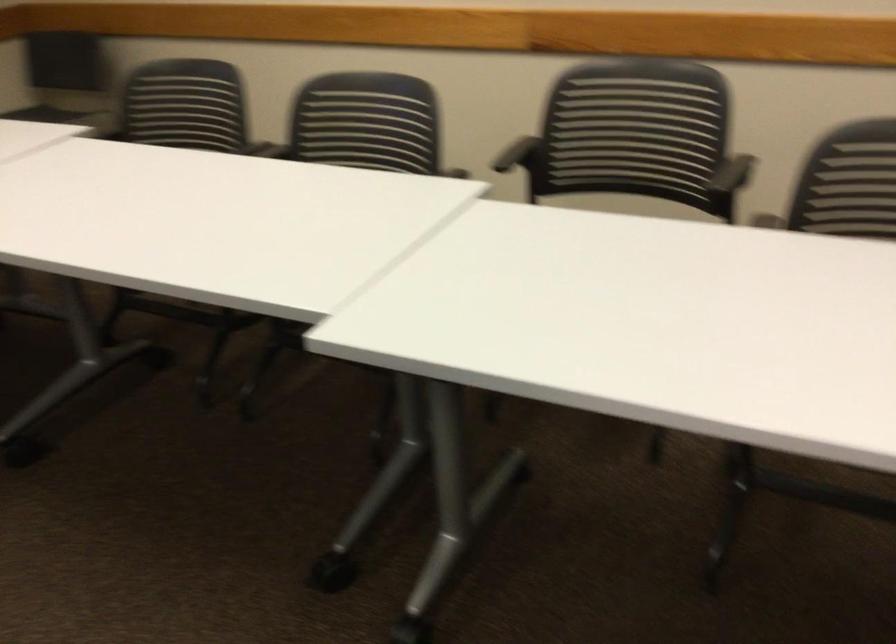
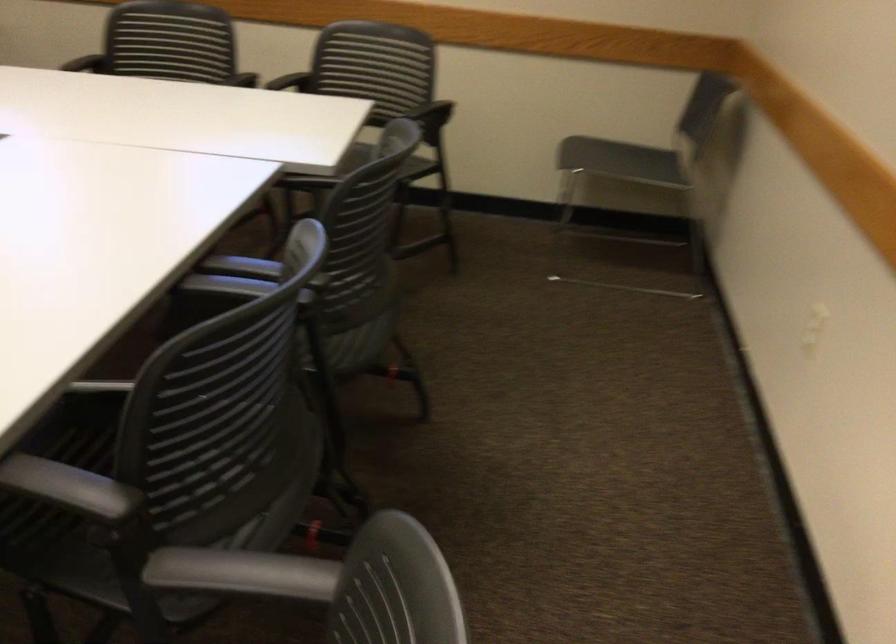
The point at (x=412, y=182) is marked in the first image. Where is the corresponding point in the second image?

(209, 458)